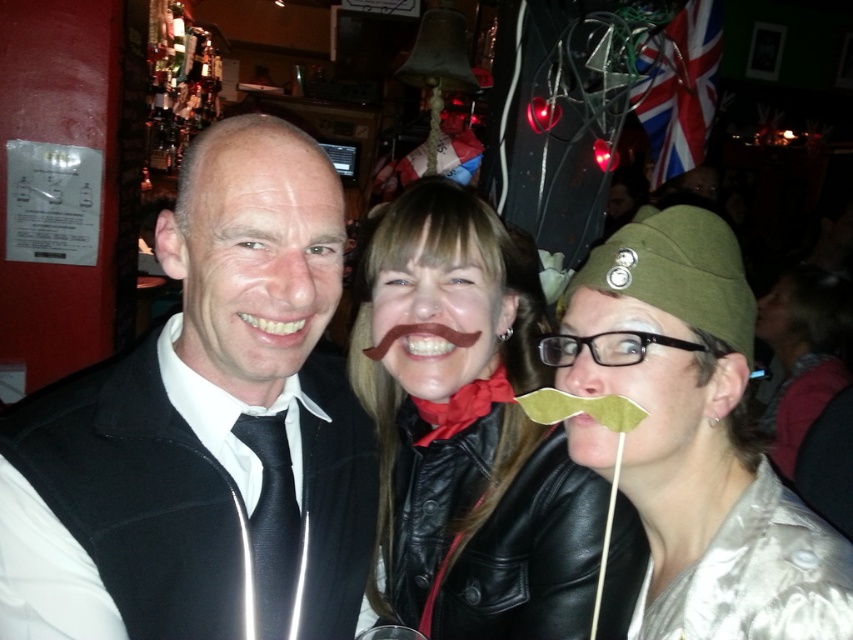
You are standing in the bar and want to reach the point at coordinates point (642, 605). If your arm length is 30 inches, can you reach it without moving?

The distance of point (642, 605) from viewer is 35.18 inches, so your arm length of 30 inches is shorter than the distance. You cannot reach it without moving.

Based on the scene description, where is the silvery metallic hat at right located in terms of its 2D coordinates?

The silvery metallic hat at right is located at the 2D coordinates point (697, 438).

You are a photographer trying to capture a closeup of the silvery metallic hat at right and the silky silver dress at lower right. Which object should you focus on first to ensure it appears sharp in the photo?

You should focus on the silvery metallic hat at right first because it is closer to you than the silky silver dress at lower right, so focusing on it will ensure it appears sharp while the dress may be slightly out of focus due to the distance difference.